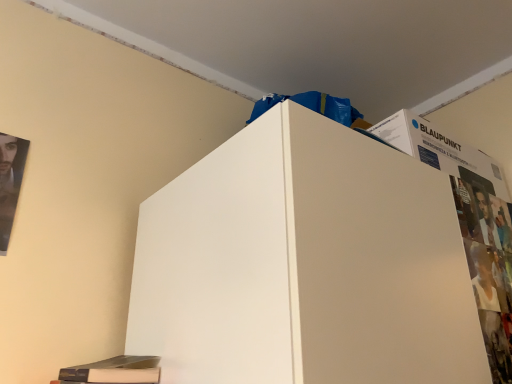
Question: Would you say matte black magazine at lower left is inside or outside matte black poster at left?

Choices:
 (A) inside
 (B) outside

Answer: (B)

Question: In terms of height, does matte black magazine at lower left look taller or shorter compared to matte black poster at left?

Choices:
 (A) short
 (B) tall

Answer: (A)

Question: Looking at their shapes, would you say matte black magazine at lower left is wider or thinner than matte black poster at left?

Choices:
 (A) wide
 (B) thin

Answer: (A)

Question: Looking at the image, does matte black poster at left seem bigger or smaller compared to matte black magazine at lower left?

Choices:
 (A) big
 (B) small

Answer: (B)

Question: From the image's perspective, relative to matte black magazine at lower left, is matte black poster at left above or below?

Choices:
 (A) above
 (B) below

Answer: (A)

Question: Based on their positions, is matte black poster at left located to the left or right of matte black magazine at lower left?

Choices:
 (A) left
 (B) right

Answer: (A)

Question: Do you think matte black poster at left is within matte black magazine at lower left, or outside of it?

Choices:
 (A) inside
 (B) outside

Answer: (B)